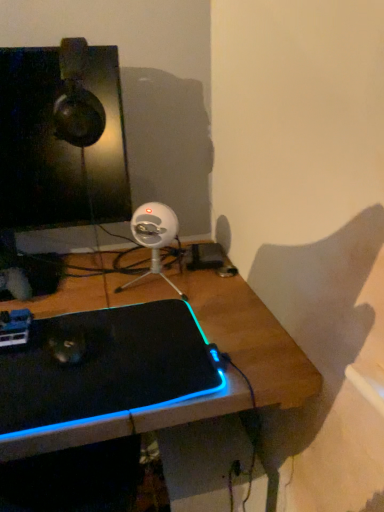
Question: Considering the positions of white plastic webcam at center and black matte laptop at center in the image, is white plastic webcam at center wider or thinner than black matte laptop at center?

Choices:
 (A) thin
 (B) wide

Answer: (A)

Question: From a real-world perspective, relative to black matte laptop at center, is white plastic webcam at center vertically above or below?

Choices:
 (A) below
 (B) above

Answer: (B)

Question: Which object is the closest to the matte black monitor at upper left?

Choices:
 (A) black matte laptop at center
 (B) white plastic webcam at center

Answer: (B)

Question: Considering the real-world distances, which object is farthest from the white plastic webcam at center?

Choices:
 (A) black matte laptop at center
 (B) matte black monitor at upper left

Answer: (A)